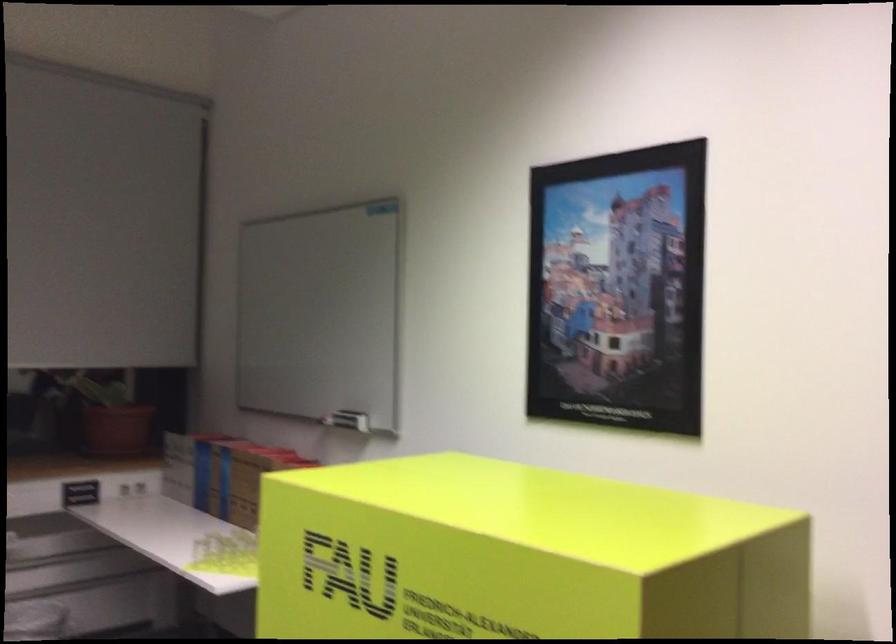
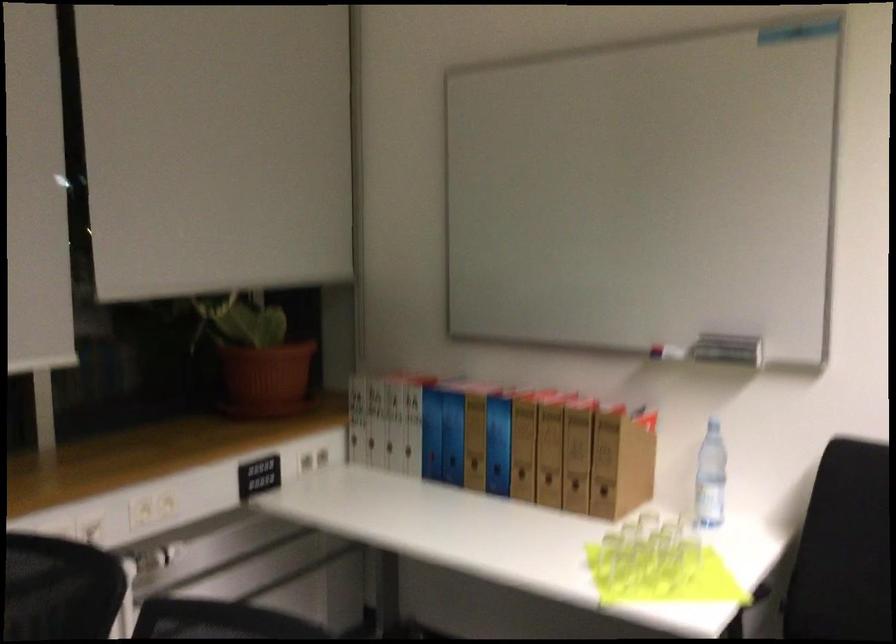
What movement of the cameraman would produce the second image?

The cameraman walked toward left, forward.